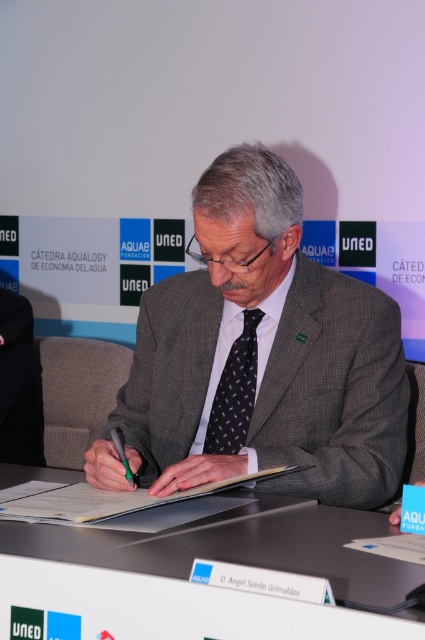
Between white plastic table at center and black dotted tie at center, which one appears on the left side from the viewer's perspective?

Positioned to the left is white plastic table at center.

Is white plastic table at center below black dotted tie at center?

Correct, white plastic table at center is located below black dotted tie at center.

What do you see at coordinates (235, 563) in the screenshot? I see `white plastic table at center` at bounding box center [235, 563].

Locate an element on the screen. white plastic table at center is located at coordinates (235, 563).

Can you confirm if black dotted tie at center is positioned to the right of black plastic pen at center?

Yes, black dotted tie at center is to the right of black plastic pen at center.

Looking at this image, between black dotted tie at center and black plastic pen at center, which one is positioned higher?

black dotted tie at center

Between point (226, 451) and point (132, 480), which one is positioned in front?

Point (132, 480)

Image resolution: width=425 pixels, height=640 pixels. I want to click on black dotted tie at center, so click(x=235, y=392).

Is gray wool suit at center above black dotted tie at center?

Yes, gray wool suit at center is above black dotted tie at center.

Which is behind, point (223, 310) or point (232, 387)?

Point (223, 310)

Locate an element on the screen. This screenshot has height=640, width=425. gray wool suit at center is located at coordinates (263, 355).